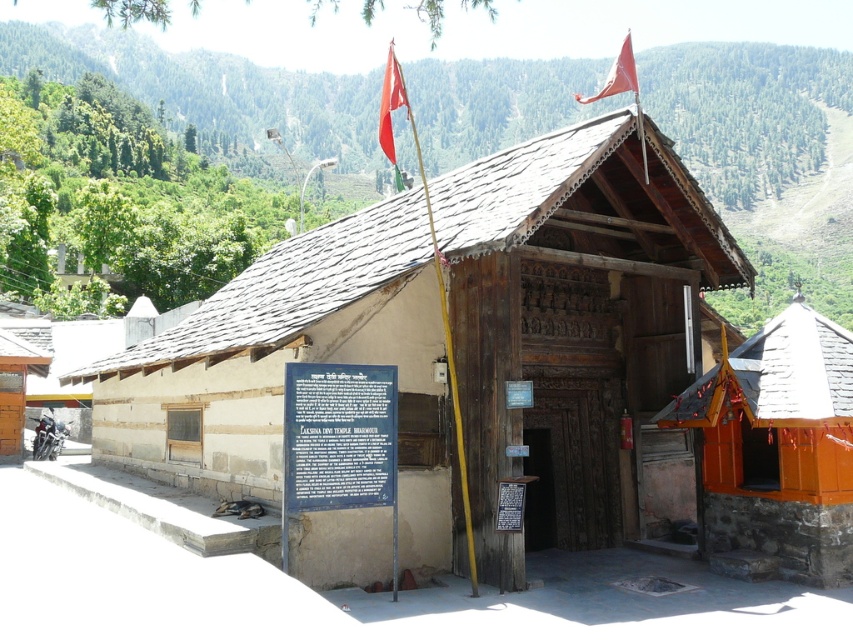
Question: Is wooden door at center bigger than black metal sign at center?

Choices:
 (A) yes
 (B) no

Answer: (A)

Question: Among these objects, which one is nearest to the camera?

Choices:
 (A) red fabric flag at upper center
 (B) orange painted wood at right
 (C) blue metal sign at center

Answer: (C)

Question: Which of the following is the farthest from the observer?

Choices:
 (A) black metal sign at center
 (B) red fabric flag at upper center
 (C) matte red flag at upper right
 (D) wooden door at center

Answer: (D)

Question: Where is wooden hut at center located in relation to wooden door at center in the image?

Choices:
 (A) left
 (B) right

Answer: (A)

Question: Among these points, which one is farthest from the camera?

Choices:
 (A) tap(828, 524)
 (B) tap(347, 381)
 (C) tap(4, 461)
 (D) tap(782, 218)

Answer: (D)

Question: Considering the relative positions of orange painted wood at right and blue metal sign at center in the image provided, where is orange painted wood at right located with respect to blue metal sign at center?

Choices:
 (A) left
 (B) right

Answer: (B)